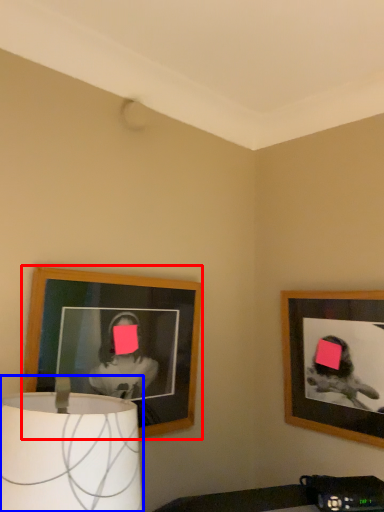
Question: Which point is closer to the camera, picture frame (highlighted by a red box) or lamp (highlighted by a blue box)?

Choices:
 (A) picture frame
 (B) lamp

Answer: (B)